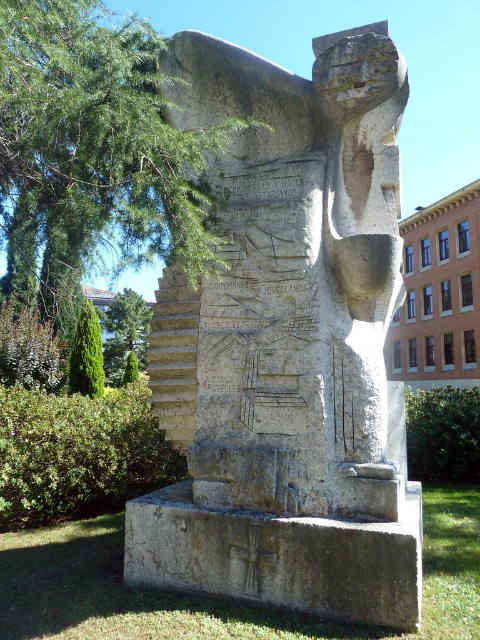
Which is more to the left, gray stone monument at center or green leafy tree at left?

From the viewer's perspective, green leafy tree at left appears more on the left side.

Describe the element at coordinates (288, 348) in the screenshot. Image resolution: width=480 pixels, height=640 pixels. I see `gray stone monument at center` at that location.

Find the location of a particular element. gray stone monument at center is located at coordinates coord(288,348).

The image size is (480, 640). In order to click on gray stone monument at center in this screenshot , I will do `click(288, 348)`.

Is gray stone monument at center below green leafy tree at lower left?

No, gray stone monument at center is not below green leafy tree at lower left.

Can you confirm if gray stone monument at center is shorter than green leafy tree at lower left?

No, gray stone monument at center is not shorter than green leafy tree at lower left.

Is point (324, 244) more distant than point (92, 378)?

No.

Locate an element on the screen. gray stone monument at center is located at coordinates (288, 348).

Is green leafy tree at left above green leafy tree at lower left?

Incorrect, green leafy tree at left is not positioned above green leafy tree at lower left.

Who is positioned more to the right, green leafy tree at left or green leafy tree at lower left?

Positioned to the right is green leafy tree at lower left.

The width and height of the screenshot is (480, 640). What are the coordinates of `green leafy tree at left` in the screenshot? It's located at (124, 333).